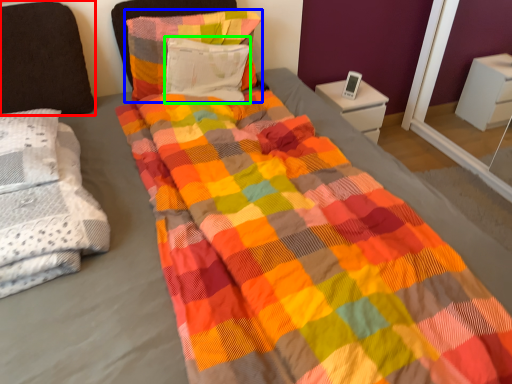
Question: Which object is positioned farthest from pillow (highlighted by a red box)? Select from pillow (highlighted by a blue box) and pillow (highlighted by a green box).

Choices:
 (A) pillow
 (B) pillow

Answer: (B)